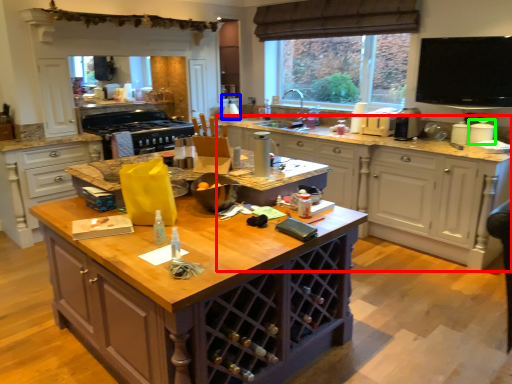
Question: Which object is the farthest from cabinetry (highlighted by a red box)? Choose among these: appliance (highlighted by a blue box) or appliance (highlighted by a green box).

Choices:
 (A) appliance
 (B) appliance

Answer: (A)